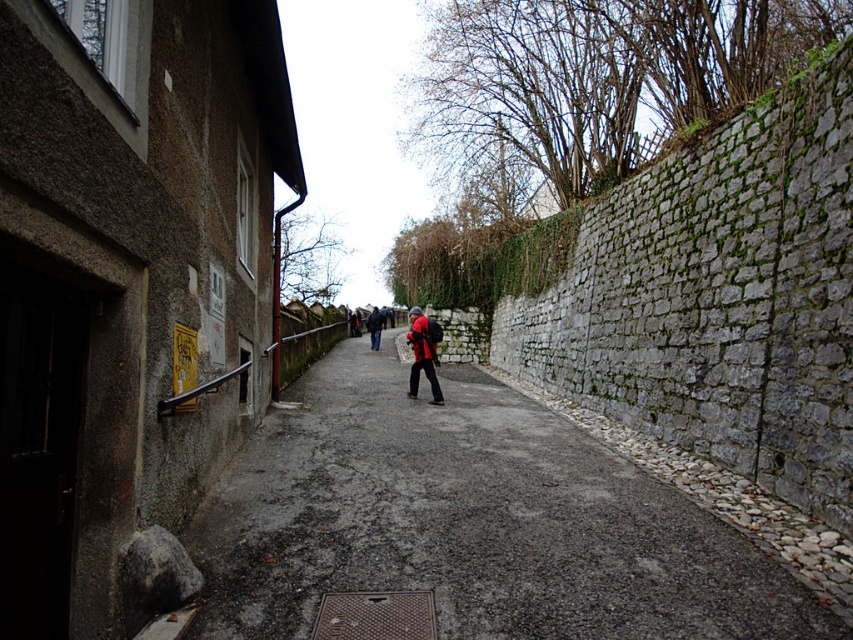
Question: Estimate the real-world distances between objects in this image. Which object is farther from the dark blue jacket at center?

Choices:
 (A) smooth concrete alley at center
 (B) matte red jacket at center

Answer: (A)

Question: Which object is the closest to the matte red jacket at center?

Choices:
 (A) smooth concrete alley at center
 (B) dark blue jacket at center

Answer: (A)

Question: Does matte black jacket at center appear on the left side of matte red jacket at center?

Choices:
 (A) no
 (B) yes

Answer: (B)

Question: Is matte black jacket at center closer to camera compared to matte red jacket at center?

Choices:
 (A) yes
 (B) no

Answer: (A)

Question: Can you confirm if matte black jacket at center is wider than dark blue jacket at center?

Choices:
 (A) no
 (B) yes

Answer: (A)

Question: Which of the following is the farthest from the observer?

Choices:
 (A) (436, 380)
 (B) (384, 321)

Answer: (B)